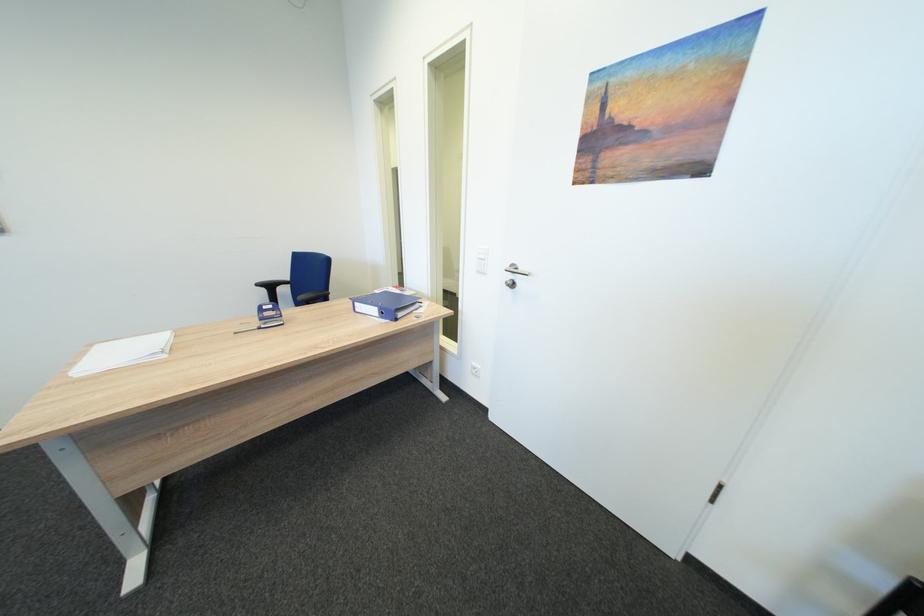
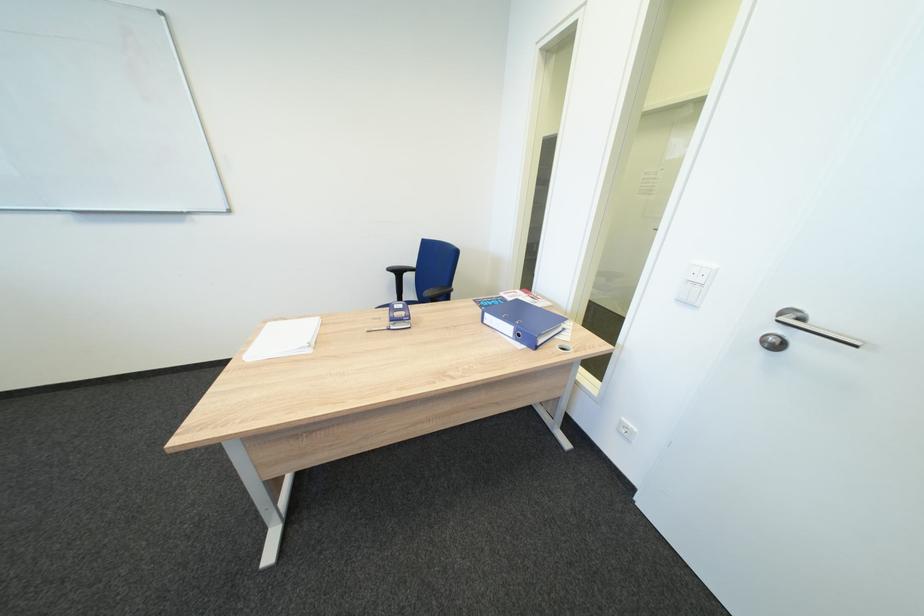
The point at (x=368, y=312) is marked in the first image. Where is the corresponding point in the second image?

(495, 323)